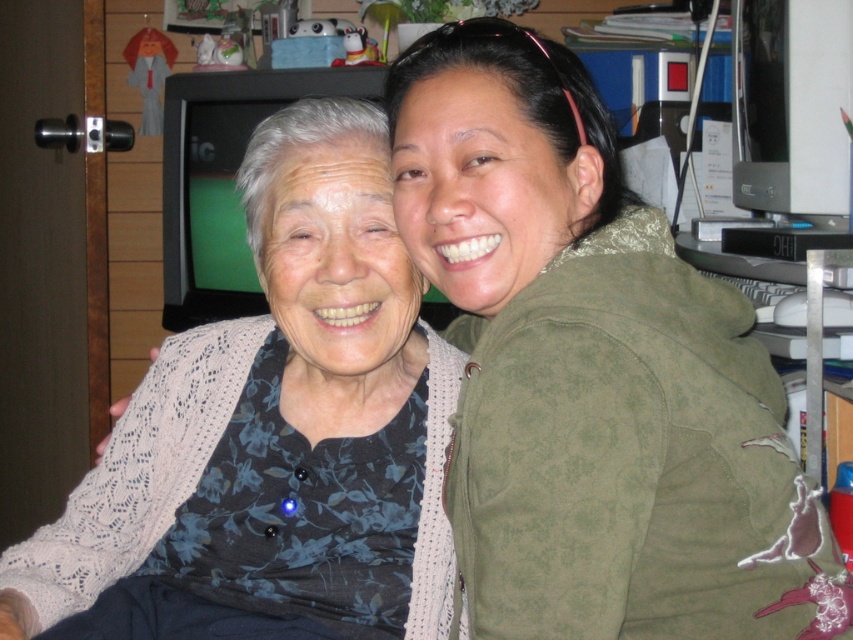
You are standing in front of the image and want to know how far the point at coordinates [555,483] is from you. Can you determine the distance?

The point at coordinates [555,483] is 26.48 inches away from the viewer.

You are standing in the room where the two people are sitting. You want to place a small plant between the two points marked as point (560, 493) and point (202, 625). Which point should the plant be closer to so that it is in front of the other point?

The plant should be closer to point (560, 493) because it is in front of point (202, 625).